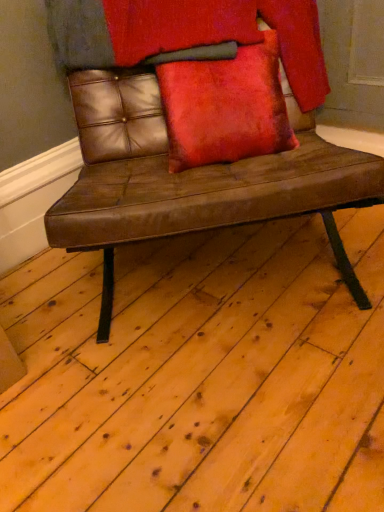
Question: Considering the positions of brown leather bench at center and velvet red pillow at center in the image, is brown leather bench at center taller or shorter than velvet red pillow at center?

Choices:
 (A) tall
 (B) short

Answer: (A)

Question: Is point [x=48, y=223] positioned closer to the camera than point [x=236, y=88]?

Choices:
 (A) closer
 (B) farther

Answer: (A)

Question: Relative to velvet red pillow at center, is brown leather bench at center in front or behind?

Choices:
 (A) behind
 (B) front

Answer: (B)

Question: Is velvet red pillow at center taller or shorter than brown leather bench at center?

Choices:
 (A) short
 (B) tall

Answer: (A)

Question: Based on their positions, is velvet red pillow at center located to the left or right of brown leather bench at center?

Choices:
 (A) left
 (B) right

Answer: (B)

Question: From a real-world perspective, is velvet red pillow at center positioned above or below brown leather bench at center?

Choices:
 (A) above
 (B) below

Answer: (A)

Question: From the image's perspective, relative to brown leather bench at center, is velvet red pillow at center above or below?

Choices:
 (A) above
 (B) below

Answer: (A)